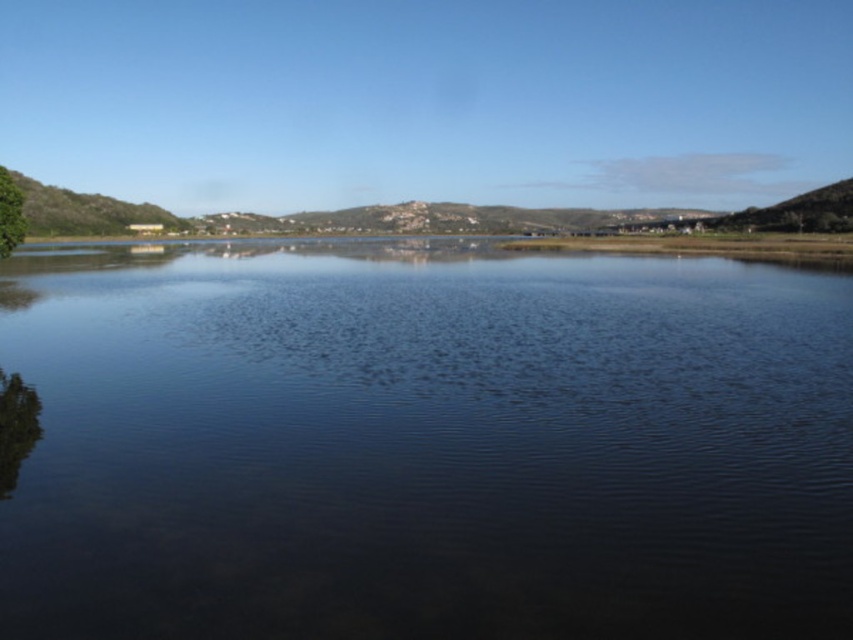
Question: Which point is farther to the camera?

Choices:
 (A) green leafy tree at left
 (B) transparent water at center

Answer: (A)

Question: From the image, what is the correct spatial relationship of transparent water at center in relation to green leafy tree at left?

Choices:
 (A) below
 (B) above

Answer: (A)

Question: In this image, where is transparent water at center located relative to green leafy tree at left?

Choices:
 (A) below
 (B) above

Answer: (A)

Question: Which object is farther from the camera taking this photo?

Choices:
 (A) transparent water at center
 (B) green leafy tree at left

Answer: (B)

Question: Is transparent water at center bigger than green leafy tree at left?

Choices:
 (A) no
 (B) yes

Answer: (B)